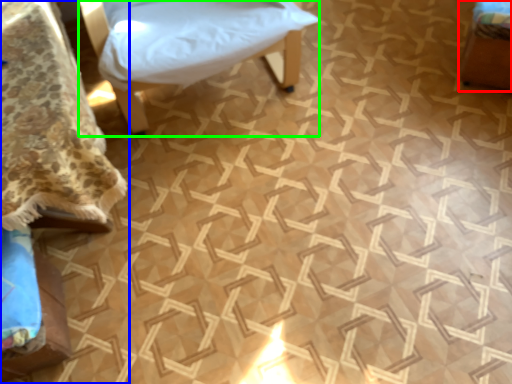
Question: Which object is positioned farthest from furniture (highlighted by a red box)? Select from furniture (highlighted by a blue box) and furniture (highlighted by a green box).

Choices:
 (A) furniture
 (B) furniture

Answer: (A)